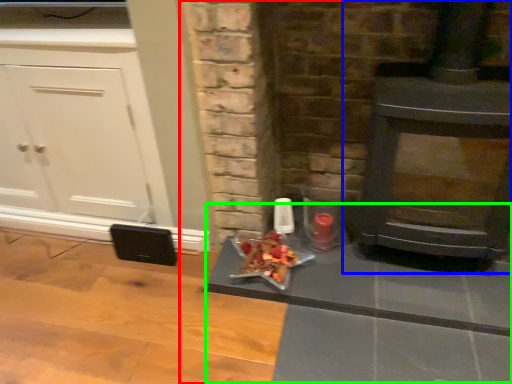
Question: Which object is the closest to the fireplace (highlighted by a red box)? Choose among these: wood burning stove (highlighted by a blue box) or table (highlighted by a green box).

Choices:
 (A) wood burning stove
 (B) table

Answer: (B)